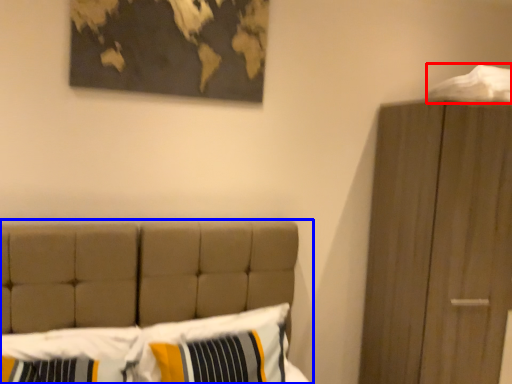
Question: Which of the following is the farthest to the observer, sheet (highlighted by a red box) or bed (highlighted by a blue box)?

Choices:
 (A) sheet
 (B) bed

Answer: (A)